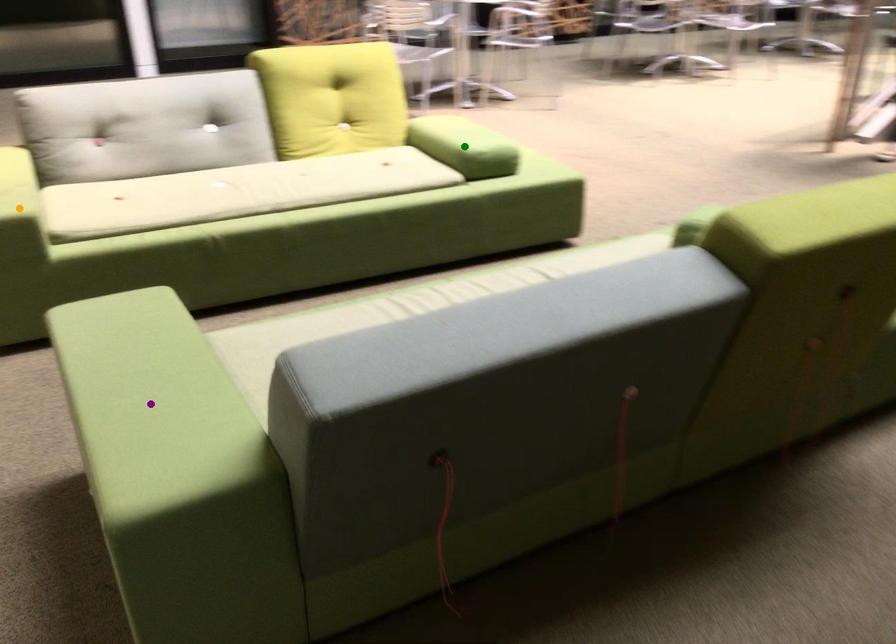
Order these from farthest to nearest:
orange point | purple point | green point

green point < orange point < purple point